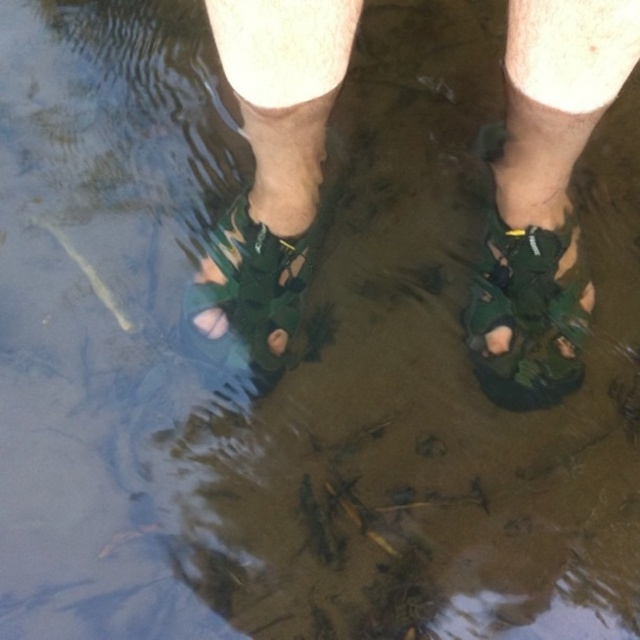
Is pink matte toe at center shorter than green matte sandal at center?

No, pink matte toe at center is not shorter than green matte sandal at center.

The image size is (640, 640). Describe the element at coordinates (211, 323) in the screenshot. I see `pink matte toe at center` at that location.

What are the coordinates of `pink matte toe at center` in the screenshot? It's located at (211, 323).

Is point (253, 195) positioned before point (282, 353)?

No, it is not.

Which is behind, point (308, 192) or point (273, 342)?

The point (308, 192) is more distant.

This screenshot has width=640, height=640. What are the coordinates of `green fabric sock at center` in the screenshot? It's located at tap(285, 161).

This screenshot has height=640, width=640. What do you see at coordinates (250, 291) in the screenshot?
I see `green fabric sandal at center` at bounding box center [250, 291].

From the picture: Is green fabric sandal at center taller than pink matte toe at center?

Correct, green fabric sandal at center is much taller as pink matte toe at center.

Find the location of a particular element. This screenshot has width=640, height=640. green fabric sandal at center is located at coordinates (250, 291).